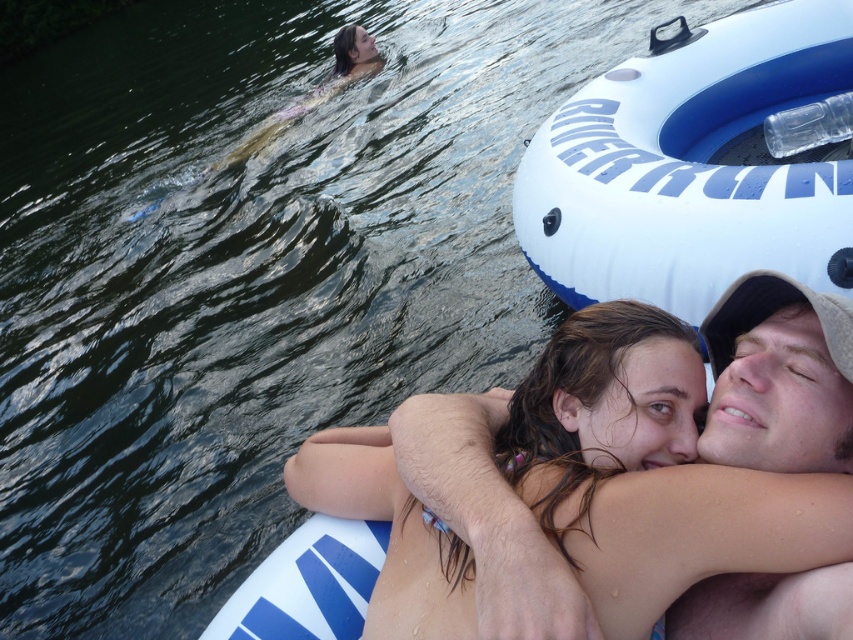
You are a photographer trying to capture a photo of the smooth skin couple at center and the white rubber ring at upper right. Since you want both subjects to be in focus, which one should you focus on first to ensure proper depth of field?

The smooth skin couple at center is in front of the white rubber ring at upper right, so you should focus on the smooth skin couple at center first to ensure both are in focus.

You are a photographer taking a photo of the smooth skin couple at center and the smooth tan skin at center. Based on their positions, which one is closer to the camera?

The smooth skin couple at center is closer to the camera because they are positioned below the smooth tan skin at center, indicating they are in a lower plane relative to the viewer.